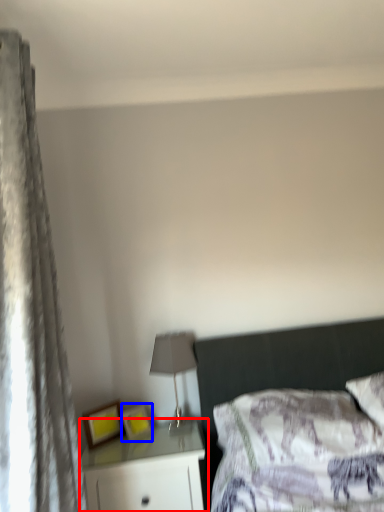
Question: Which point is further to the camera, nightstand (highlighted by a red box) or picture frame (highlighted by a blue box)?

Choices:
 (A) nightstand
 (B) picture frame

Answer: (B)